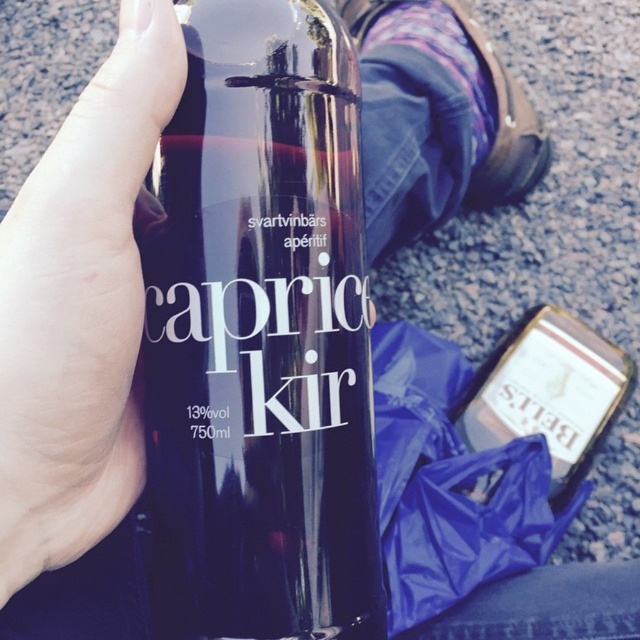
Does glossy glass bottle at upper center appear on the right side of smooth skin hand at upper left?

Indeed, glossy glass bottle at upper center is positioned on the right side of smooth skin hand at upper left.

Is glossy glass bottle at upper center positioned in front of smooth skin hand at upper left?

No, glossy glass bottle at upper center is further to the viewer.

Does point (323, 330) come farther from viewer compared to point (64, 422)?

Yes, point (323, 330) is behind point (64, 422).

Find the location of a particular element. This screenshot has height=640, width=640. glossy glass bottle at upper center is located at coordinates (259, 336).

Between smooth skin hand at upper left and matte gold bottle at lower right, which one has less height?

smooth skin hand at upper left is shorter.

Is the position of smooth skin hand at upper left less distant than that of matte gold bottle at lower right?

Yes, smooth skin hand at upper left is in front of matte gold bottle at lower right.

The image size is (640, 640). I want to click on smooth skin hand at upper left, so click(80, 307).

The image size is (640, 640). What are the coordinates of `smooth skin hand at upper left` in the screenshot? It's located at (80, 307).

Does glossy glass bottle at upper center appear over matte gold bottle at lower right?

Yes, glossy glass bottle at upper center is above matte gold bottle at lower right.

Is point (317, 444) positioned before point (492, 419)?

Yes, it is in front of point (492, 419).

You are a GUI agent. You are given a task and a screenshot of the screen. Output one action in this format:
    pyautogui.click(x=<x>, y=<y>)
    Task: Click on the glossy glass bottle at upper center
    The height and width of the screenshot is (640, 640).
    Given the screenshot: What is the action you would take?
    pyautogui.click(x=259, y=336)